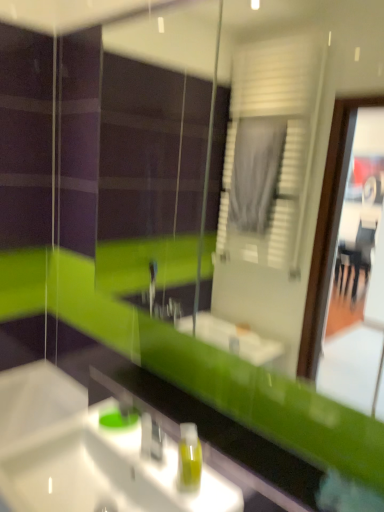
You are a GUI agent. You are given a task and a screenshot of the screen. Output one action in this format:
    pyautogui.click(x=<x>, y=<y>)
    Task: Click on the vacant space to the left of green translucent soap dispenser at lower center
    This screenshot has width=384, height=512.
    Given the screenshot: What is the action you would take?
    pyautogui.click(x=152, y=468)